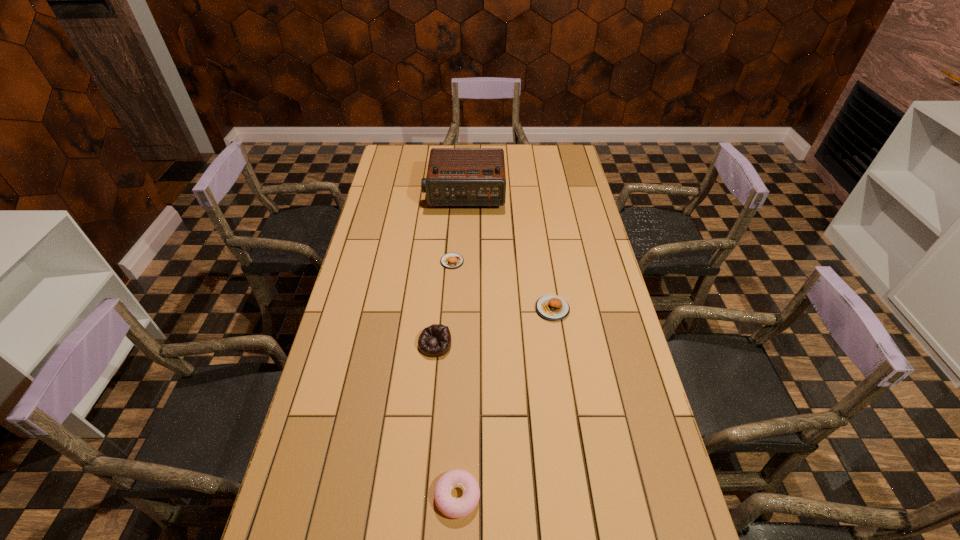
At what (x,y) coordinates should I click in order to perform the action: click on the farthest object. Please return your answer as a coordinate pair (x, y). The height and width of the screenshot is (540, 960). Looking at the image, I should click on (455, 176).

Locate an element on the screen. radio receiver is located at coordinates (455, 176).

This screenshot has height=540, width=960. What are the coordinates of `beanbag` in the screenshot? It's located at (434, 341).

At what (x,y) coordinates should I click in order to perform the action: click on the farther food. Please return your answer as a coordinate pair (x, y). The height and width of the screenshot is (540, 960). Looking at the image, I should click on (452, 260).

Locate an element on the screen. This screenshot has height=540, width=960. the left food is located at coordinates (452, 260).

Locate an element on the screen. This screenshot has height=540, width=960. the third farthest object is located at coordinates (551, 307).

Image resolution: width=960 pixels, height=540 pixels. What are the coordinates of `the rightmost object` in the screenshot? It's located at (551, 307).

Locate an element on the screen. the nearest object is located at coordinates (458, 508).

In order to click on vacant space positioned 0.320m on the front panel of the radio receiver in this screenshot , I will do `click(462, 266)`.

You are a GUI agent. You are given a task and a screenshot of the screen. Output one action in this format:
    pyautogui.click(x=<x>, y=<y>)
    Task: Click on the free space located on the right of the fourth farthest object
    
    Given the screenshot: What is the action you would take?
    (x=534, y=345)